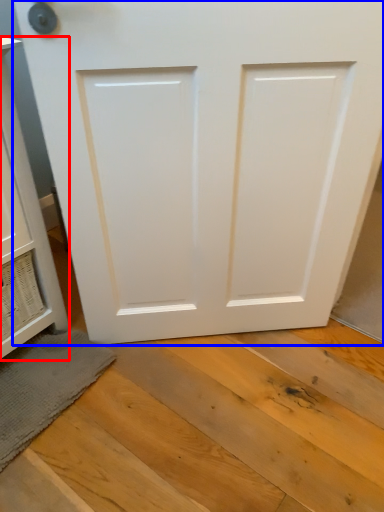
Question: Which object appears closest to the camera in this image, cabinetry (highlighted by a red box) or door (highlighted by a blue box)?

Choices:
 (A) cabinetry
 (B) door

Answer: (A)